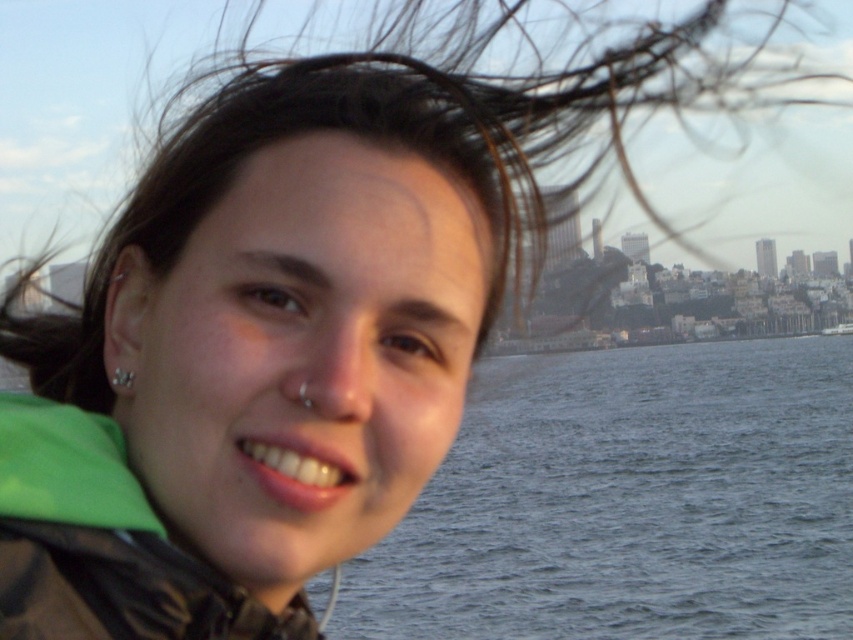
You are a photographer trying to capture the scene from the perspective of the person in the image. Which object, the blue water at center or the green fabric jacket at lower left, would appear larger in your photo?

The blue water at center would appear larger in the photo because it is much taller than the green fabric jacket at lower left.

You are standing at the origin point of the image. Which direction should you move to reach the blue water at center?

The blue water at center is located at coordinate point [630,502], so you should move towards the lower right direction from your current position to reach it.